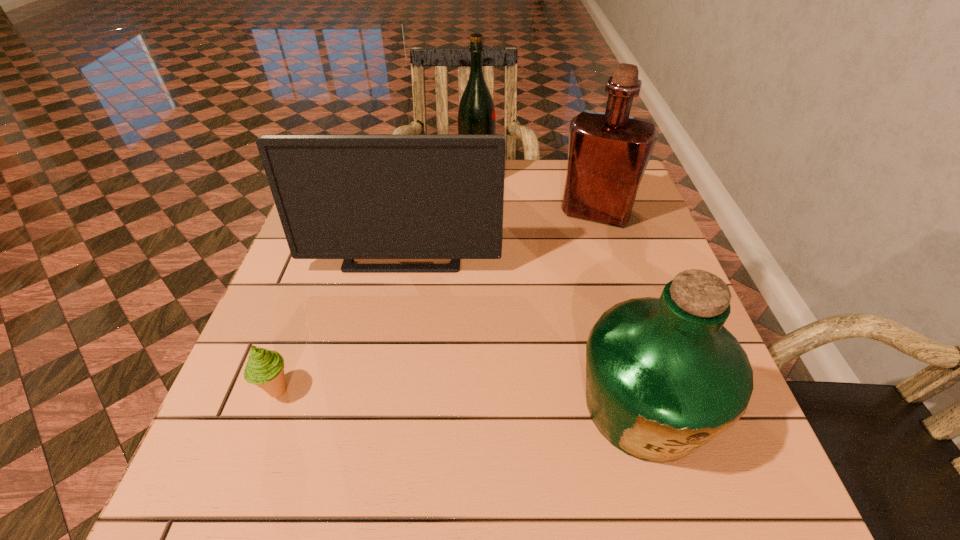
I want to click on free region located 0.140m on the front of the shortest object, so click(241, 491).

At what (x,y) coordinates should I click in order to perform the action: click on object at the near edge. Please return your answer as a coordinate pair (x, y). This screenshot has width=960, height=540. Looking at the image, I should click on (664, 377).

Identify the location of computer monitor that is at the left edge. Image resolution: width=960 pixels, height=540 pixels. (339, 196).

The width and height of the screenshot is (960, 540). I want to click on icecream that is at the left edge, so click(x=265, y=368).

You are a GUI agent. You are given a task and a screenshot of the screen. Output one action in this format:
    pyautogui.click(x=<x>, y=<y>)
    Task: Click on the object located at the far right corner
    
    Given the screenshot: What is the action you would take?
    pyautogui.click(x=608, y=153)

Find the location of a particular element. Image resolution: width=960 pixels, height=540 pixels. object that is at the near right corner is located at coordinates (664, 377).

This screenshot has height=540, width=960. Identify the location of blank space at the far edge of the desktop. (523, 188).

Where is `vacant area at the near edge of the desktop`? This screenshot has width=960, height=540. vacant area at the near edge of the desktop is located at coordinates (574, 497).

What are the coordinates of `free space at the left edge of the desktop` in the screenshot? It's located at (248, 435).

This screenshot has height=540, width=960. In order to click on vacant space that is in between the shortest object and the computer monitor in this screenshot , I will do `click(341, 320)`.